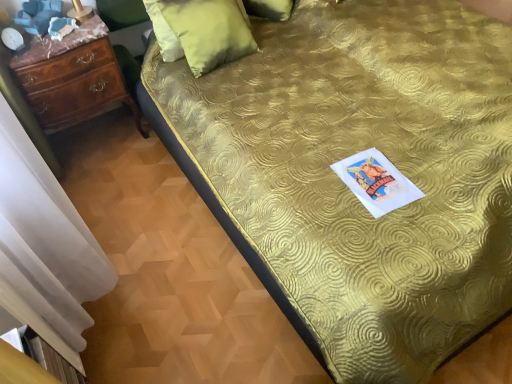
Identify the location of free space in front of mahogany wood chest of drawers at left. Image resolution: width=512 pixels, height=384 pixels. (110, 181).